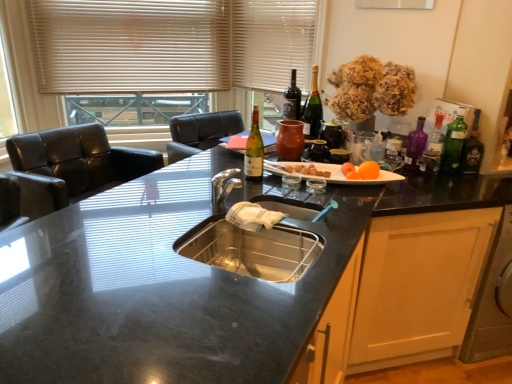
Locate an element on the screen. The height and width of the screenshot is (384, 512). free location above white fabric curtain at upper center (from a real-world perspective) is located at coordinates (278, 1).